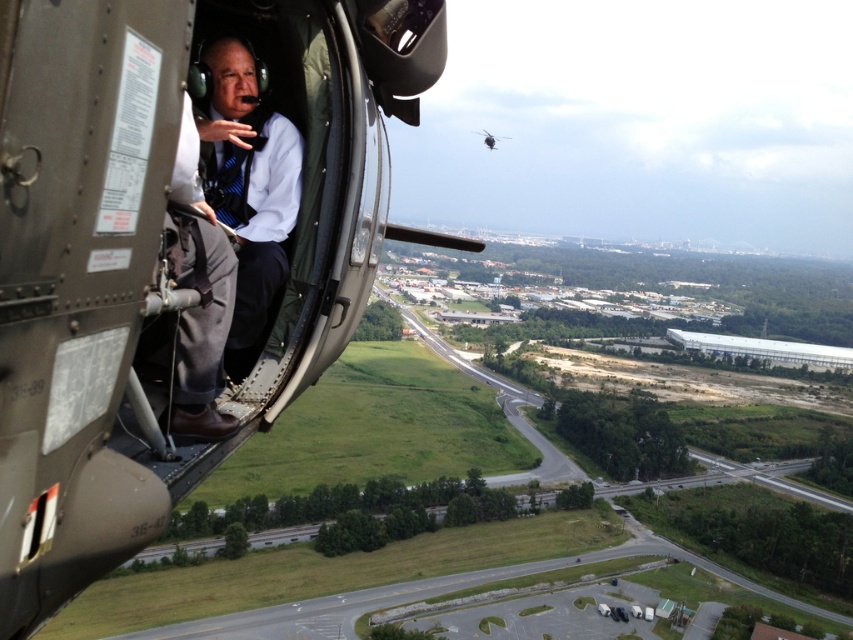
Does metallic gray helicopter at left have a greater height compared to matte black shirt at center?

Yes, metallic gray helicopter at left is taller than matte black shirt at center.

How much distance is there between metallic gray helicopter at left and matte black shirt at center?

metallic gray helicopter at left is 9.30 feet away from matte black shirt at center.

Identify the location of metallic gray helicopter at left. The image size is (853, 640). (173, 248).

Does metallic gray helicopter at left appear on the right side of metallic silver helicopter at upper center?

No, metallic gray helicopter at left is not to the right of metallic silver helicopter at upper center.

The width and height of the screenshot is (853, 640). In order to click on metallic gray helicopter at left in this screenshot , I will do `click(173, 248)`.

Which is in front, point (19, 244) or point (494, 141)?

Point (19, 244) is in front.

This screenshot has height=640, width=853. In order to click on metallic gray helicopter at left in this screenshot , I will do `click(173, 248)`.

Can you confirm if matte black shirt at center is smaller than metallic silver helicopter at upper center?

Correct, matte black shirt at center occupies less space than metallic silver helicopter at upper center.

Between point (267, 129) and point (479, 131), which one is positioned in front?

Point (267, 129)

Find the location of a particular element. This screenshot has width=853, height=640. matte black shirt at center is located at coordinates (248, 188).